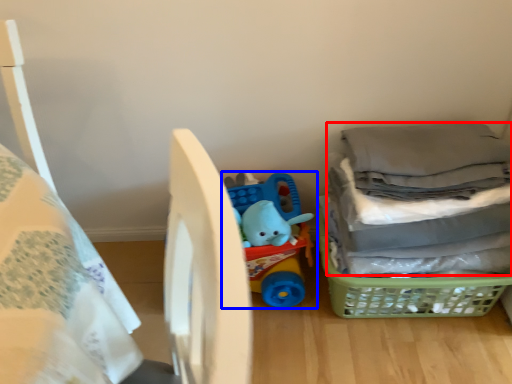
Question: Which object is further to the camera taking this photo, laundry (highlighted by a red box) or toy (highlighted by a blue box)?

Choices:
 (A) laundry
 (B) toy

Answer: (B)